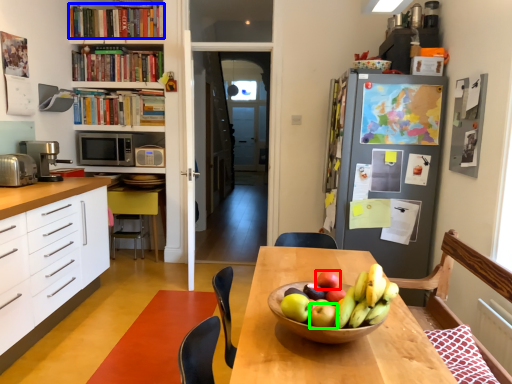
Question: Which object is positioned closest to apple (highlighted by a red box)? Select from book (highlighted by a blue box) and apple (highlighted by a green box).

Choices:
 (A) book
 (B) apple

Answer: (B)